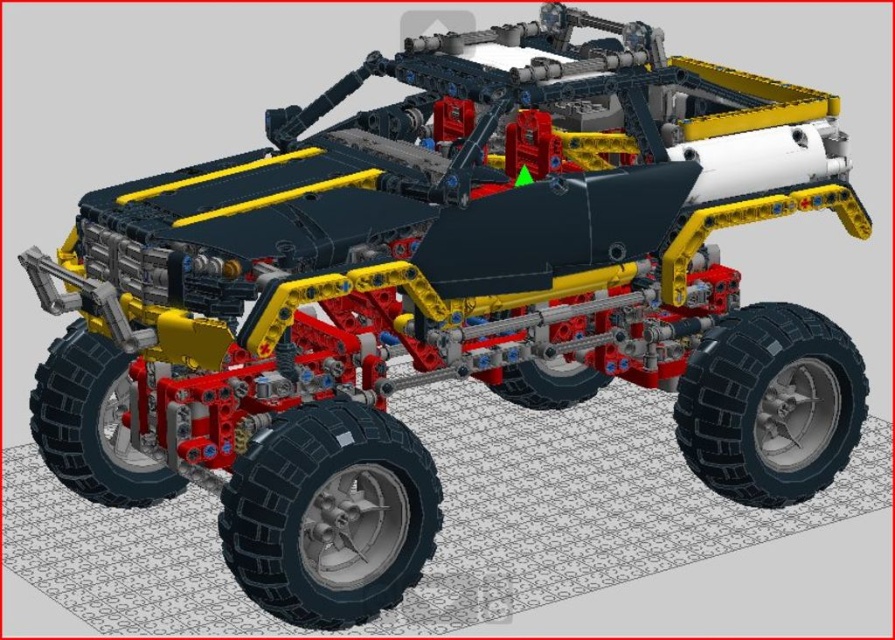
Consider the image. Between black rubber tire at lower left and black rubber tire at center, which one has more height?

black rubber tire at lower left is taller.

Who is positioned more to the left, black rubber tire at lower left or black rubber tire at center?

black rubber tire at lower left

Locate an element on the screen. This screenshot has width=895, height=640. black rubber tire at lower left is located at coordinates (92, 422).

Is point (780, 413) more distant than point (539, 369)?

No.

Which is in front, point (837, 440) or point (590, 387)?

Point (837, 440) is in front.

What are the coordinates of `black rubber tire at lower right` in the screenshot? It's located at (770, 404).

You are a GUI agent. You are given a task and a screenshot of the screen. Output one action in this format:
    pyautogui.click(x=<x>, y=<y>)
    Task: Click on the black rubber tire at lower center
    The width and height of the screenshot is (895, 640).
    Given the screenshot: What is the action you would take?
    pyautogui.click(x=329, y=515)

Can you confirm if black rubber tire at lower center is bigger than black rubber tire at lower left?

Yes, black rubber tire at lower center is bigger than black rubber tire at lower left.

The image size is (895, 640). Describe the element at coordinates (329, 515) in the screenshot. I see `black rubber tire at lower center` at that location.

I want to click on black rubber tire at lower center, so click(x=329, y=515).